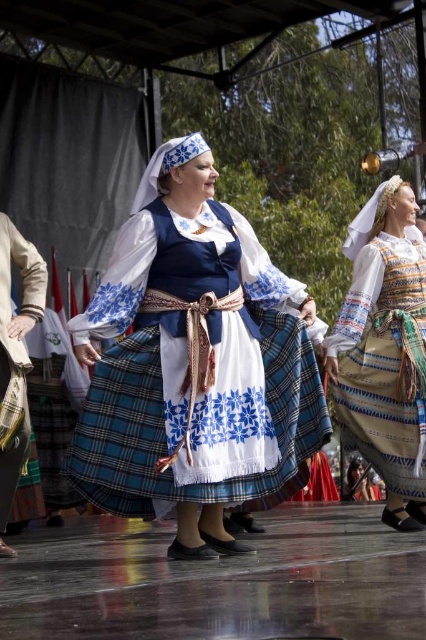
You are a photographer at a cultural festival, and you want to capture the embroidered fabric dress at center and the plaid fabric skirt at center in a single frame. Based on their positions, which one is more to the right?

The embroidered fabric dress at center is positioned on the right side of the plaid fabric skirt at center, so the embroidered fabric dress at center is more to the right.